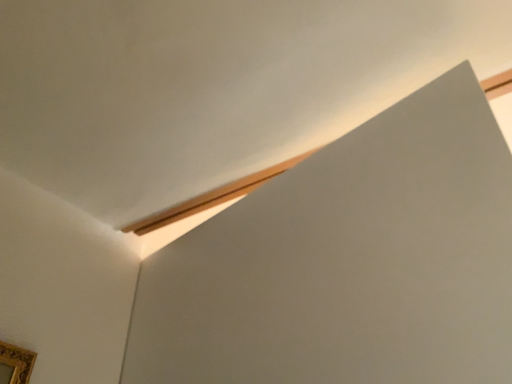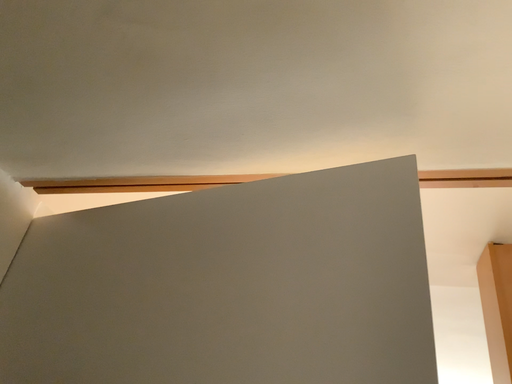
Question: Which way did the camera rotate in the video?

Choices:
 (A) rotated left
 (B) rotated right

Answer: (B)